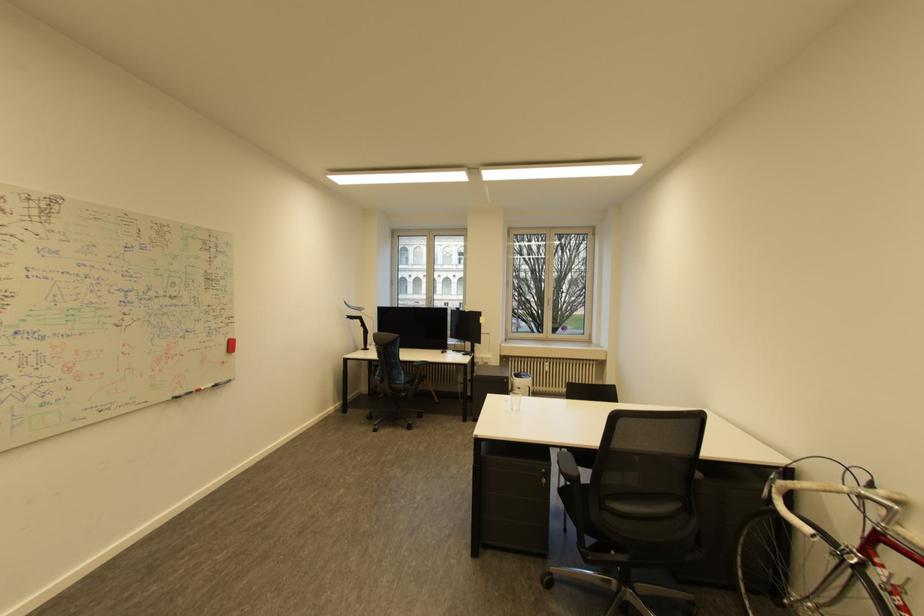
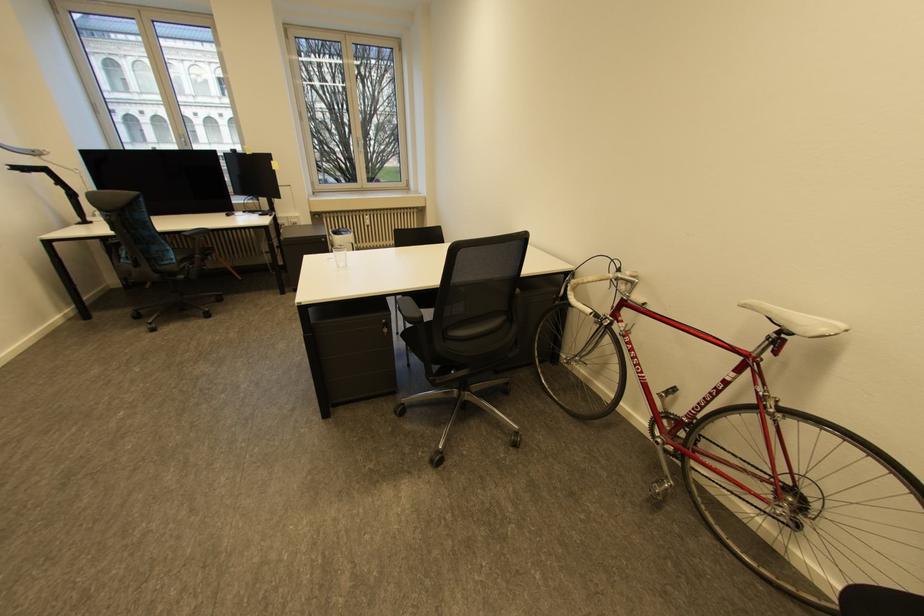
The point at (556,302) is marked in the first image. Where is the corresponding point in the second image?

(367, 143)